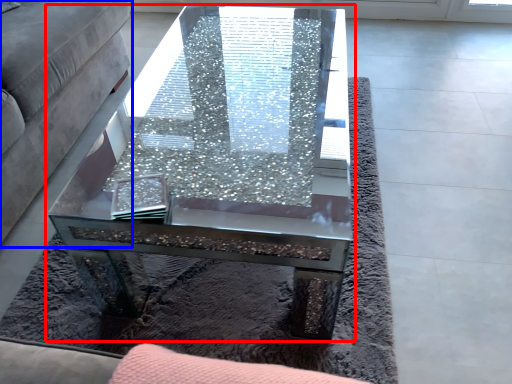
Question: Which object appears closest to the camera in this image, coffee table (highlighted by a red box) or studio couch (highlighted by a blue box)?

Choices:
 (A) coffee table
 (B) studio couch

Answer: (B)